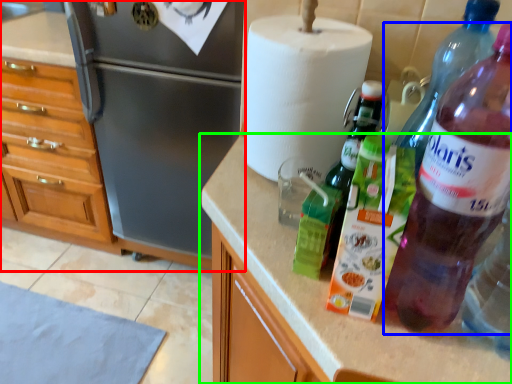
Question: Considering the real-world distances, which object is farthest from cabinetry (highlighted by a red box)? bottle (highlighted by a blue box) or countertop (highlighted by a green box)?

Choices:
 (A) bottle
 (B) countertop

Answer: (A)